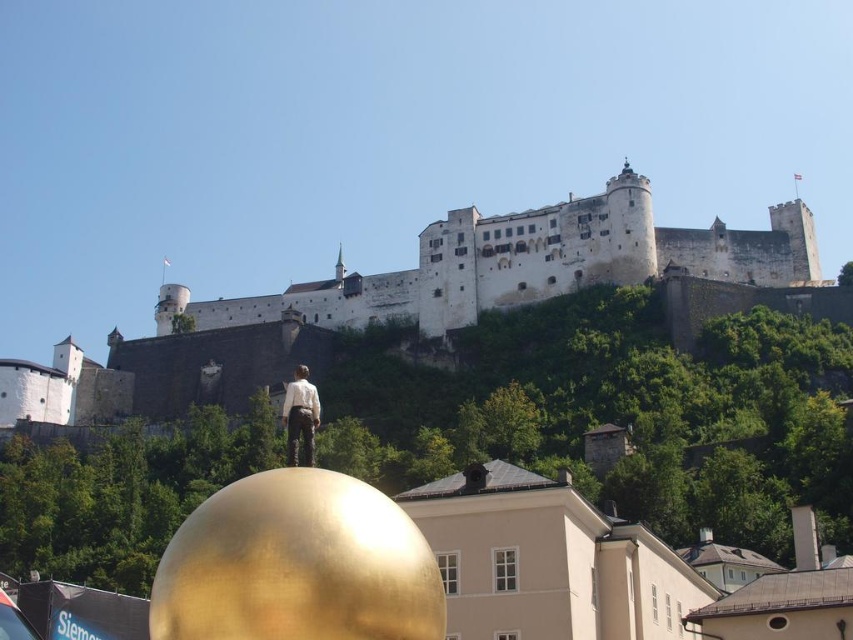
You are a tourist standing at the base of the fortress. You see the white stone castle at upper center and the matte white shirt at center. Which object is positioned to the right of the other?

The white stone castle at upper center is to the right of the matte white shirt at center.

You are a photographer planning to capture the historic fortress and the golden sphere sculpture in the foreground. Given that the white stone castle at upper center is wider than the matte white shirt at center, which object would appear more prominent in your photo?

The white stone castle at upper center would appear more prominent in the photo since its width is larger than that of the matte white shirt at center.